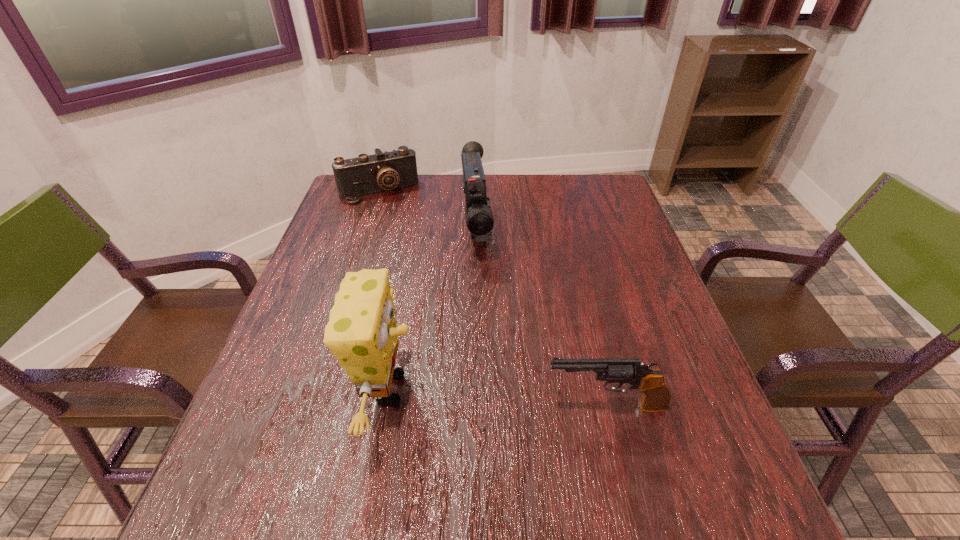
The width and height of the screenshot is (960, 540). What are the coordinates of `object that is positioned at the far left corner` in the screenshot? It's located at (367, 174).

In the image, there is a desktop. At what (x,y) coordinates should I click in order to perform the action: click on free space at the far edge. Please return your answer as a coordinate pair (x, y). Looking at the image, I should click on (402, 204).

In order to click on free space at the left edge of the desktop in this screenshot , I will do `click(293, 379)`.

In the image, there is a desktop. Where is `vacant space at the right edge`? The width and height of the screenshot is (960, 540). vacant space at the right edge is located at coordinates (612, 280).

The height and width of the screenshot is (540, 960). In the image, there is a desktop. In order to click on vacant area at the far right corner in this screenshot , I will do `click(613, 206)`.

Find the location of a particular element. blank area at the near right corner is located at coordinates (723, 435).

The height and width of the screenshot is (540, 960). What are the coordinates of `free space between the third shortest object and the sponge` in the screenshot? It's located at (432, 309).

Identify the location of vacant area that lies between the rightmost object and the camera. (492, 299).

Identify the location of free space between the gun and the sponge. The width and height of the screenshot is (960, 540). (497, 398).

The width and height of the screenshot is (960, 540). Identify the location of unoccupied position between the camcorder and the sponge. tap(432, 309).